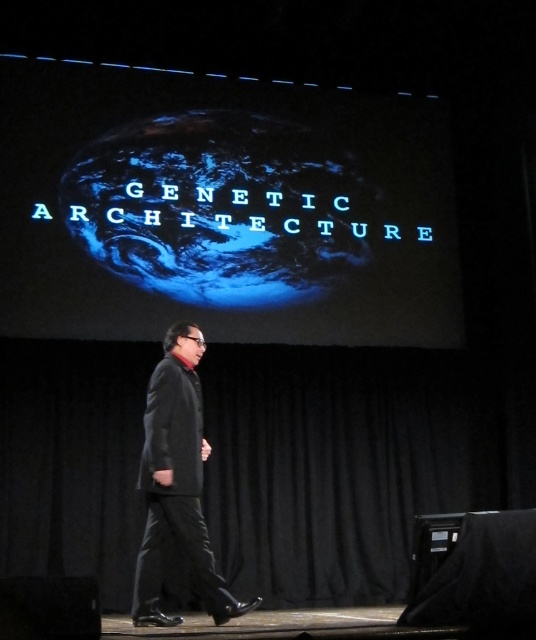
You are an astronomer analyzing the image of the stage. You notice a point at coordinates (221,209). What object is located at that point?

The blue glossy planet at center is located at point (221,209).